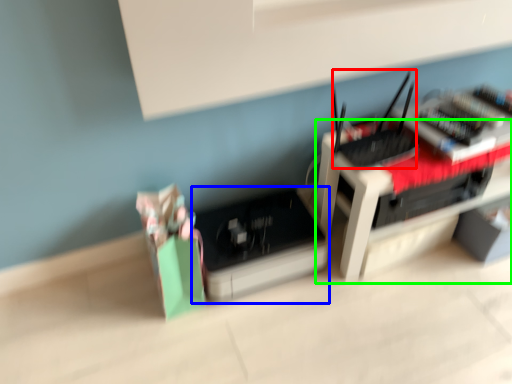
Question: Which object is positioned closest to register (highlighted by a red box)? Select from register (highlighted by a blue box) and furniture (highlighted by a green box).

Choices:
 (A) register
 (B) furniture

Answer: (B)